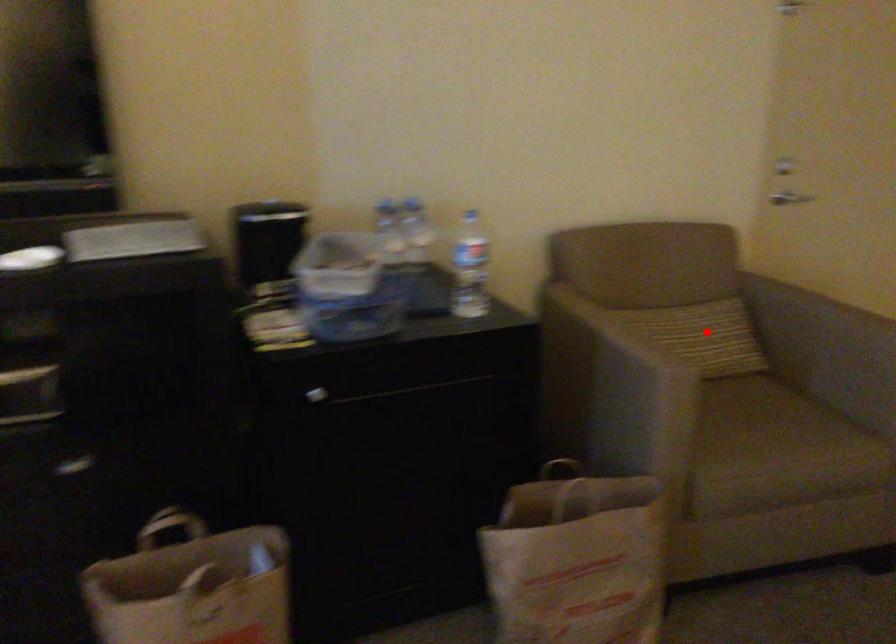
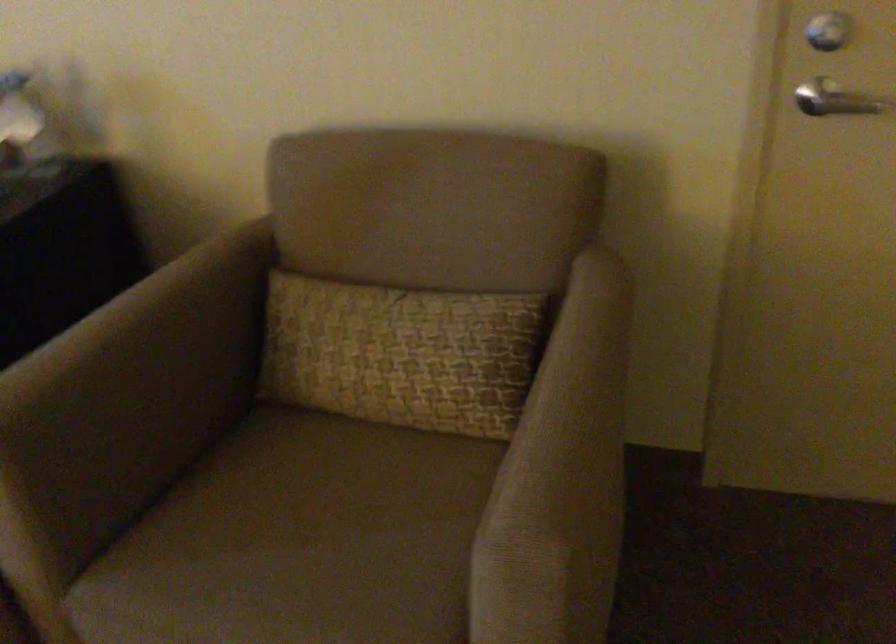
Where in the second image is the point corresponding to the highlighted location from the first image?

(401, 353)